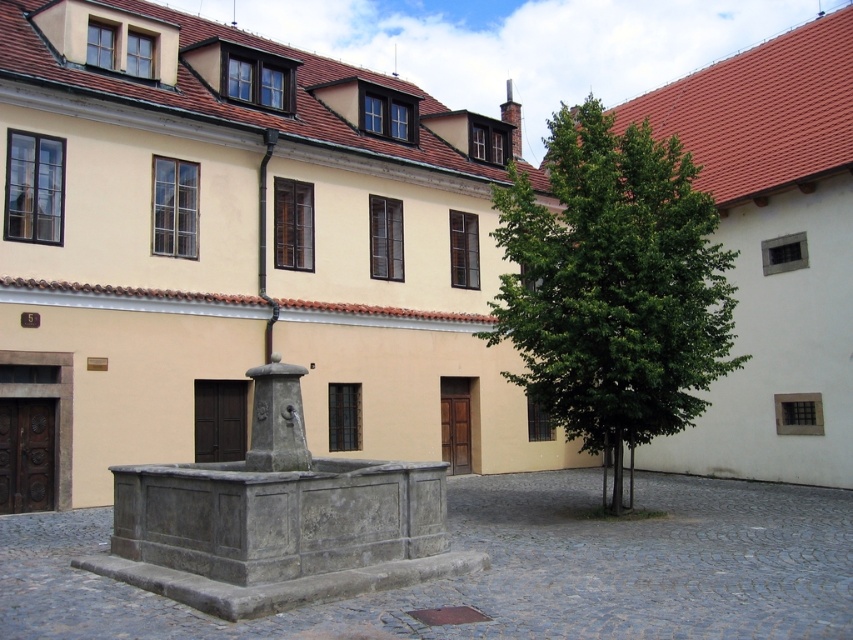
Question: Is green leafy tree at center behind gray stone fountain at center?

Choices:
 (A) yes
 (B) no

Answer: (A)

Question: Does green leafy tree at center appear under gray stone fountain at center?

Choices:
 (A) yes
 (B) no

Answer: (B)

Question: Does green leafy tree at center appear over gray stone fountain at center?

Choices:
 (A) yes
 (B) no

Answer: (A)